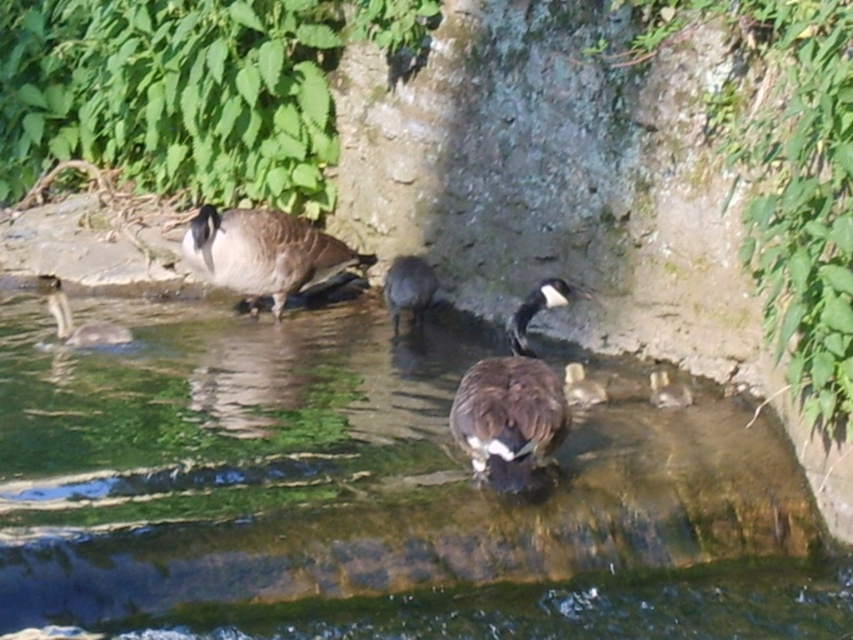
Question: Is clear water at center wider than brown matte duck at center?

Choices:
 (A) no
 (B) yes

Answer: (B)

Question: Where is brown matte goose at center located in relation to brown fuzzy duckling at lower right in the image?

Choices:
 (A) left
 (B) right

Answer: (A)

Question: Which object is the closest to the brown fuzzy duckling at lower right?

Choices:
 (A) brown matte duck at center
 (B) brown feathered duckling at lower left
 (C) brown fuzzy goose at center
 (D) clear water at center

Answer: (A)

Question: Which of the following is the farthest from the observer?

Choices:
 (A) coord(602,396)
 (B) coord(186,234)
 (C) coord(519,410)

Answer: (B)

Question: Can you confirm if dark brown feathers at center is bigger than brown matte duck at center?

Choices:
 (A) no
 (B) yes

Answer: (B)

Question: Among these points, which one is farthest from the camera?

Choices:
 (A) (672, 385)
 (B) (567, 429)
 (C) (320, 548)

Answer: (A)